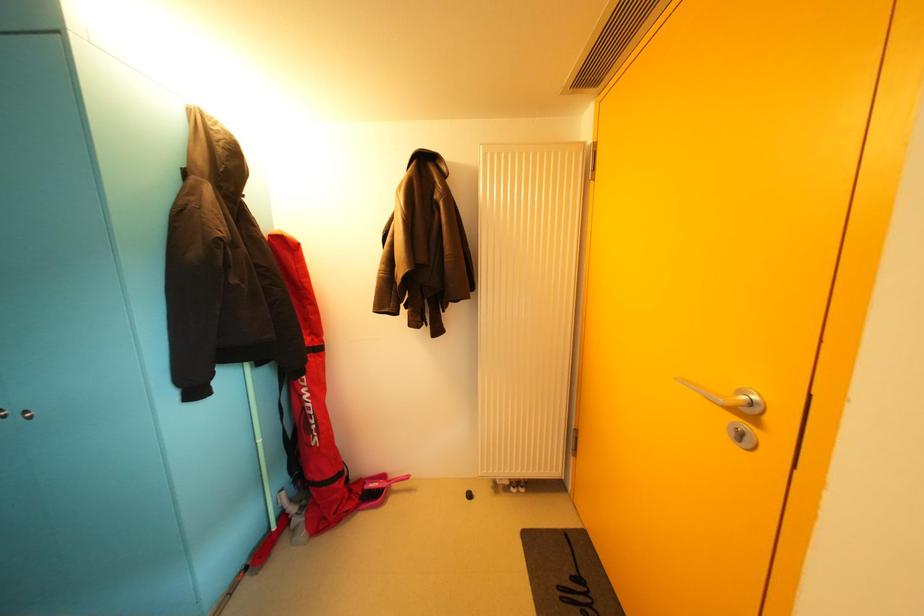
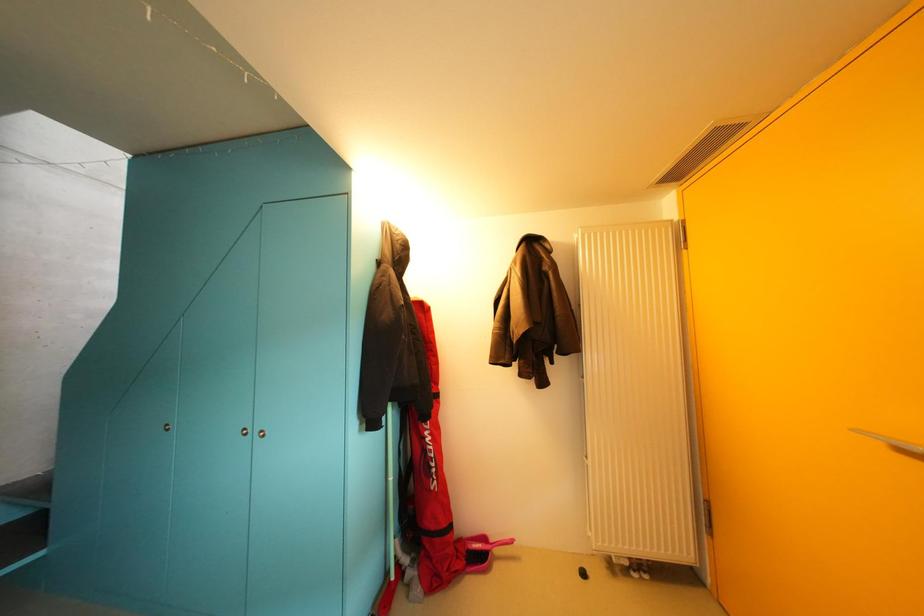
The images are taken continuously from a first-person perspective. In which direction are you moving?

The movement direction of the cameraman is left, backward.